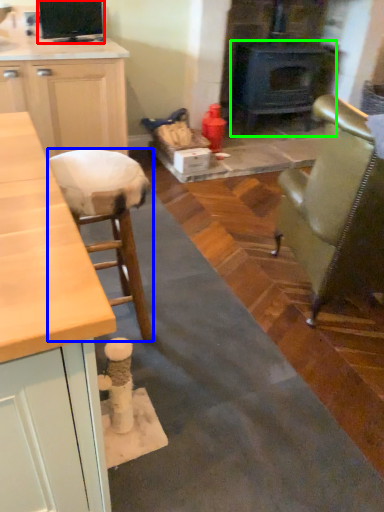
Question: Which object is the farthest from appliance (highlighted by a red box)? Choose among these: stool (highlighted by a blue box) or wood burning stove (highlighted by a green box).

Choices:
 (A) stool
 (B) wood burning stove

Answer: (B)